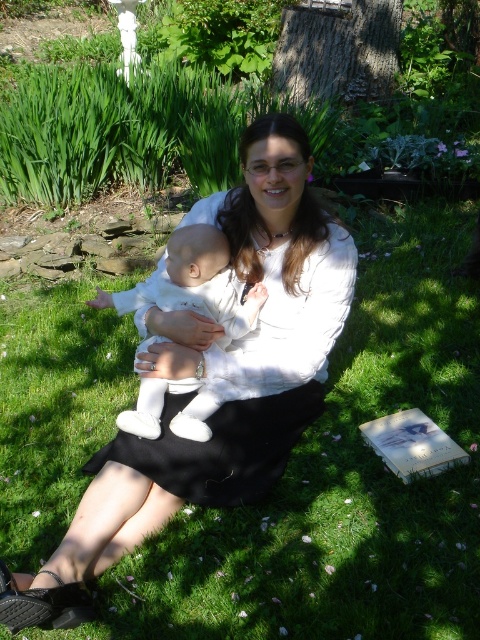
Is point (237, 442) in front of point (252, 314)?

Yes.

Is black matte dress at center thinner than white soft fabric baby at center?

No.

Which is in front, point (325, 288) or point (188, 273)?

Positioned in front is point (188, 273).

Where is `black matte dress at center`? black matte dress at center is located at coordinates (255, 364).

Can you confirm if white matte dress at center is bigger than black matte dress at center?

Yes.

Consider the image. Can you confirm if white matte dress at center is positioned above black matte dress at center?

No.

Find the location of `white matte dress at center`. white matte dress at center is located at coordinates (215, 380).

Is point (157, 472) in front of point (228, 248)?

Yes, point (157, 472) is closer to viewer.

Based on the photo, which of these two, white matte dress at center or white soft fabric baby at center, stands taller?

With more height is white matte dress at center.

The image size is (480, 640). I want to click on white matte dress at center, so click(x=215, y=380).

Image resolution: width=480 pixels, height=640 pixels. Find the location of `white matte dress at center`. white matte dress at center is located at coordinates (215, 380).